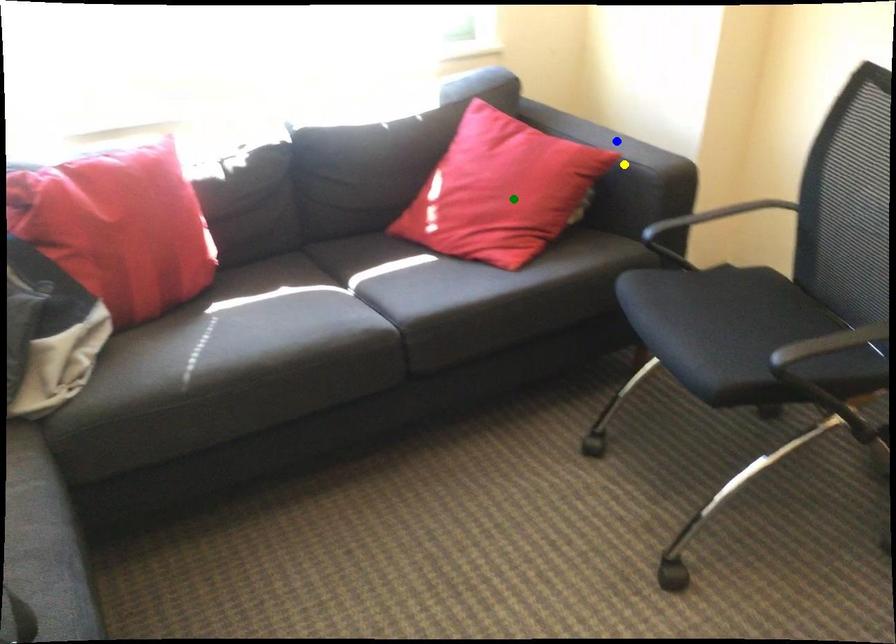
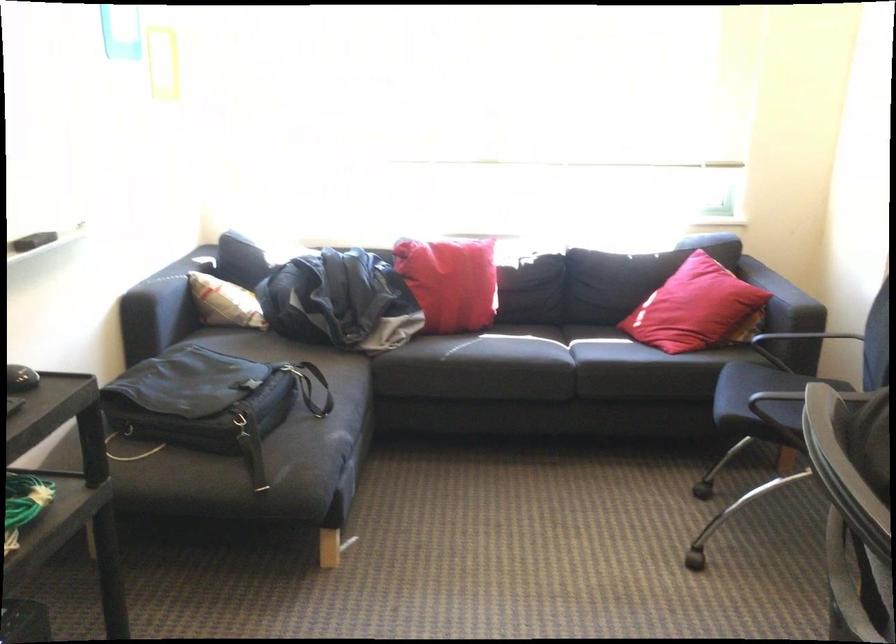
I am providing you with two images of the same scene from different viewpoints. Three points are marked in image1. Which point corresponds to a part or object that is occluded in image2?In image1, three points are marked. Which of them correspond to a part or object that is occluded in image2?Among the three points shown in image1, which one corresponds to a part or object that is no longer visible due to occlusion in image2?

blue point